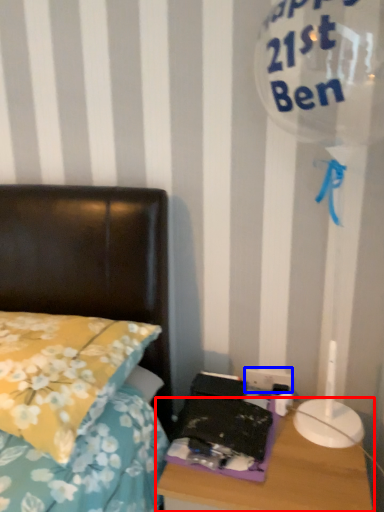
Question: Among these objects, which one is farthest to the camera, nightstand (highlighted by a red box) or electric outlet (highlighted by a blue box)?

Choices:
 (A) nightstand
 (B) electric outlet

Answer: (B)